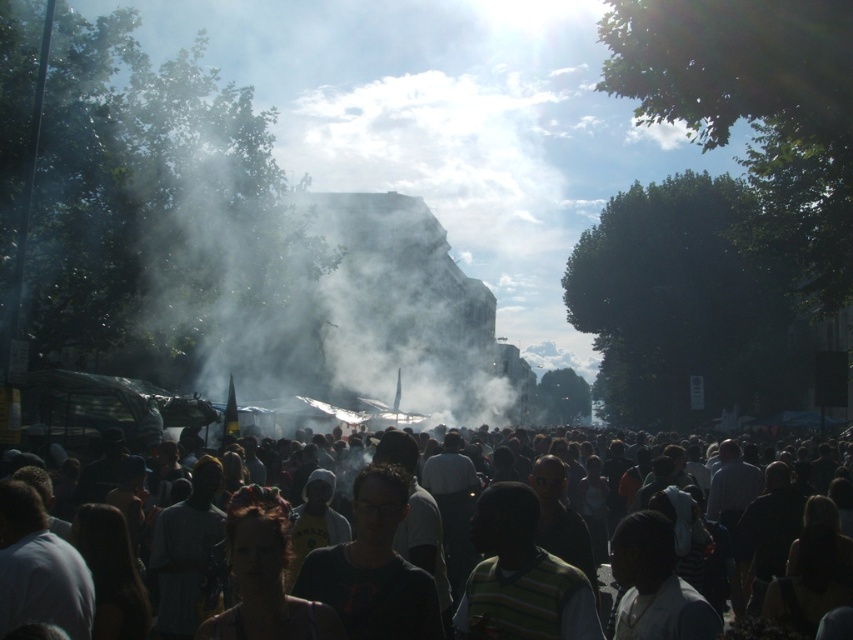
You are a photographer trying to capture a clear shot of the striped cotton shirt at center. However, there is a dark clothing crowd at center in the way. Can you estimate whether the crowd is wider than the shirt, making it harder to get a clear shot?

The dark clothing crowd at center is wider than the striped cotton shirt at center, so it would block the view of the shirt, making it difficult to capture a clear shot.

You are a photographer standing in the middle of the crowd. You want to capture a clear photo of the white vapor at center without the dark clothing crowd at center blocking it. Is this possible?

The white vapor at center is further to the viewer than the dark clothing crowd at center, so the crowd is closer to you. Therefore, the dark clothing crowd at center would block your view of the white vapor at center, making it difficult to capture a clear photo without the crowd obstructing it.